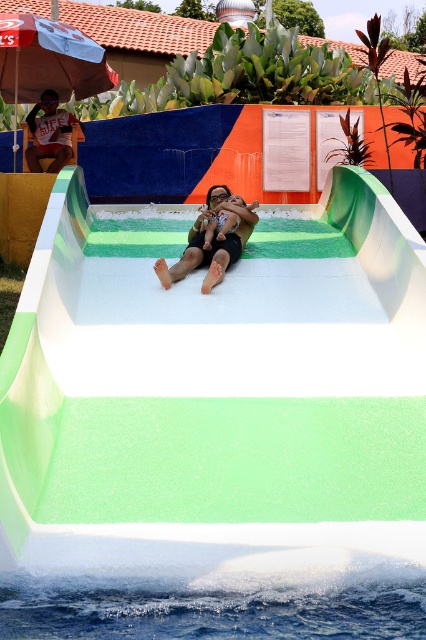
You are standing at the bottom of the water slide and looking up. There are two points marked on the slide. The first point is at coordinate point (x=48, y=92) and the second is at point (x=226, y=195). Which point will you see first as you look up the slide?

Point (x=48, y=92) is further to the camera than point (x=226, y=195), so you will see point (x=48, y=92) first as you look up the slide.

You are standing at the entrance of the water slide area and want to locate the green rubber pool at center. According to the coordinate system where the bottom left corner is the origin, which direction should you look to find it?

The green rubber pool at center is located at coordinate point 0.628 on the x axis and 0.507 on the y axis. Since the origin is at the bottom left corner, you should look towards the upper right direction to find it.